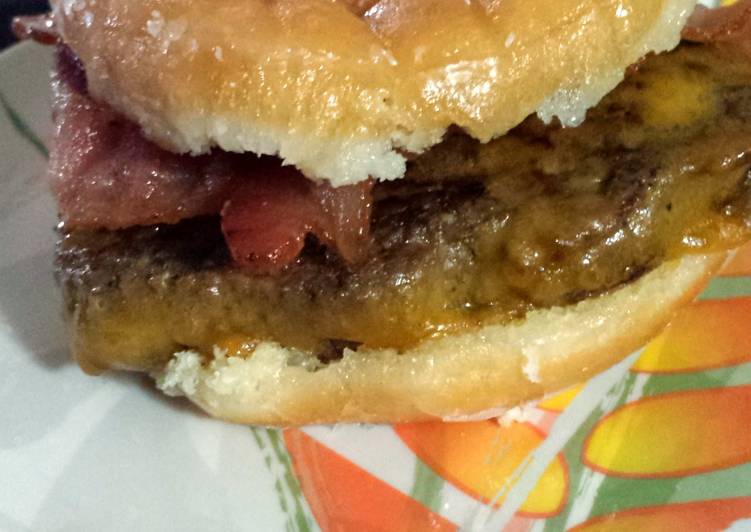
Where is `table cloth`? The image size is (751, 532). table cloth is located at coordinates (318, 485), (210, 475), (707, 426).